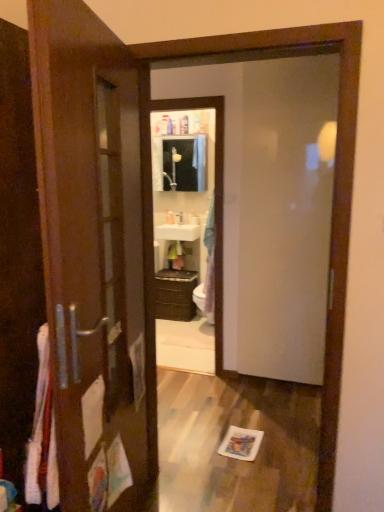
Find the location of a particular element. The height and width of the screenshot is (512, 384). transparent glass door at center is located at coordinates (281, 217).

The width and height of the screenshot is (384, 512). I want to click on matte white medicine cabinet at center, so click(180, 163).

Find the location of a particular element. The image size is (384, 512). brown matte cabinet at center is located at coordinates (175, 294).

In the image, is transparent glass door at center positioned in front of or behind brown matte cabinet at center?

In the image, transparent glass door at center appears in front of brown matte cabinet at center.

Which object is wider, transparent glass door at center or brown matte cabinet at center?

brown matte cabinet at center.

From a real-world perspective, between transparent glass door at center and brown matte cabinet at center, who is vertically lower?

brown matte cabinet at center.

In terms of width, does white glossy soap dispenser at center look wider or thinner when compared to matte white medicine cabinet at center?

Clearly, white glossy soap dispenser at center has less width compared to matte white medicine cabinet at center.

Considering the relative sizes of white glossy soap dispenser at center and matte white medicine cabinet at center in the image provided, is white glossy soap dispenser at center bigger than matte white medicine cabinet at center?

No, white glossy soap dispenser at center is not bigger than matte white medicine cabinet at center.

From the image's perspective, is white glossy soap dispenser at center over matte white medicine cabinet at center?

Incorrect, from the image's perspective, white glossy soap dispenser at center is lower than matte white medicine cabinet at center.

From a real-world perspective, which object rests below the other?

white glossy soap dispenser at center.

Would you say white glossy soap dispenser at center is outside brown matte cabinet at center?

Yes, white glossy soap dispenser at center is outside of brown matte cabinet at center.

From the image's perspective, which one is positioned higher, white glossy soap dispenser at center or brown matte cabinet at center?

white glossy soap dispenser at center.

Consider the image. Which is closer to the camera, (173, 222) or (192, 285)?

Point (173, 222).

Is white glossy soap dispenser at center smaller than brown matte cabinet at center?

Indeed, white glossy soap dispenser at center has a smaller size compared to brown matte cabinet at center.

Consider the image. Is brown matte cabinet at center in front of or behind white glossy soap dispenser at center in the image?

brown matte cabinet at center is positioned closer to the viewer than white glossy soap dispenser at center.

In the scene shown: What's the angular difference between brown matte cabinet at center and white glossy soap dispenser at center's facing directions?

There is a 5.26-degree angle between the facing directions of brown matte cabinet at center and white glossy soap dispenser at center.

Does brown matte cabinet at center turn towards white glossy soap dispenser at center?

No, brown matte cabinet at center is not facing towards white glossy soap dispenser at center.

Considering the relative sizes of brown matte cabinet at center and white glossy soap dispenser at center in the image provided, is brown matte cabinet at center taller than white glossy soap dispenser at center?

Yes.

Is point (180, 239) closer to viewer compared to point (313, 269)?

That is False.

Is white glossy sink at center closer to camera compared to transparent glass door at center?

No, it is behind transparent glass door at center.

Considering the relative sizes of white glossy sink at center and transparent glass door at center in the image provided, is white glossy sink at center thinner than transparent glass door at center?

No, white glossy sink at center is not thinner than transparent glass door at center.

What are the coordinates of `sink behind the transparent glass door at center` in the screenshot? It's located at (179, 228).

Which is behind, point (185, 236) or point (162, 276)?

Positioned behind is point (162, 276).

Is brown matte cabinet at center at the back of white glossy sink at center?

That's not correct — white glossy sink at center is not looking away from brown matte cabinet at center.

The width and height of the screenshot is (384, 512). In order to click on cabinetry below the white glossy sink at center (from the image's perspective) in this screenshot , I will do `click(175, 294)`.

Where is `medicine cabinet that appears above the brown matte cabinet at center (from the image's perspective)`? medicine cabinet that appears above the brown matte cabinet at center (from the image's perspective) is located at coordinates (180, 163).

Is brown matte cabinet at center smaller than matte white medicine cabinet at center?

No, brown matte cabinet at center is not smaller than matte white medicine cabinet at center.

From the picture: How distant is brown matte cabinet at center from matte white medicine cabinet at center?

A distance of 1.22 meters exists between brown matte cabinet at center and matte white medicine cabinet at center.

From a real-world perspective, who is located lower, brown matte cabinet at center or matte white medicine cabinet at center?

In real-world perspective, brown matte cabinet at center is lower.

Identify the location of screen door above the brown matte cabinet at center (from a real-world perspective). The height and width of the screenshot is (512, 384). (281, 217).

Find the location of `toiletry on the left of matte white medicine cabinet at center`. toiletry on the left of matte white medicine cabinet at center is located at coordinates (170, 217).

Looking at the image, which one is located closer to white glossy sink at center, brown matte cabinet at center or matte white medicine cabinet at center?

matte white medicine cabinet at center.

Looking at the image, which one is located further to brown matte cabinet at center, matte white medicine cabinet at center or transparent glass door at center?

Based on the image, transparent glass door at center appears to be further to brown matte cabinet at center.

Based on their spatial positions, is transparent glass door at center or matte white medicine cabinet at center further from brown matte cabinet at center?

Based on the image, transparent glass door at center appears to be further to brown matte cabinet at center.

Estimate the real-world distances between objects in this image. Which object is closer to brown matte cabinet at center, white glossy soap dispenser at center or matte white medicine cabinet at center?

white glossy soap dispenser at center is positioned closer to the anchor brown matte cabinet at center.

Based on the photo, from the image, which object appears to be farther from matte white medicine cabinet at center, white glossy sink at center or white glossy soap dispenser at center?

Based on the image, white glossy soap dispenser at center appears to be further to matte white medicine cabinet at center.

Which object lies further to the anchor point transparent glass door at center, matte white medicine cabinet at center or brown matte cabinet at center?

The object further to transparent glass door at center is matte white medicine cabinet at center.

Based on their spatial positions, is white glossy sink at center or transparent glass door at center closer to matte white medicine cabinet at center?

Among the two, white glossy sink at center is located nearer to matte white medicine cabinet at center.

Considering their positions, is transparent glass door at center positioned further to brown matte cabinet at center than white glossy sink at center?

transparent glass door at center is further to brown matte cabinet at center.

The width and height of the screenshot is (384, 512). I want to click on sink that lies between white glossy soap dispenser at center and brown matte cabinet at center from top to bottom, so click(x=179, y=228).

At what (x,y) coordinates should I click in order to perform the action: click on sink between transparent glass door at center and matte white medicine cabinet at center in the front-back direction. Please return your answer as a coordinate pair (x, y). The width and height of the screenshot is (384, 512). Looking at the image, I should click on (179, 228).

Find the location of `toiletry between matte white medicine cabinet at center and white glossy sink at center from top to bottom`. toiletry between matte white medicine cabinet at center and white glossy sink at center from top to bottom is located at coordinates coord(170,217).

In order to click on cabinetry between transparent glass door at center and white glossy soap dispenser at center from front to back in this screenshot , I will do `click(175, 294)`.